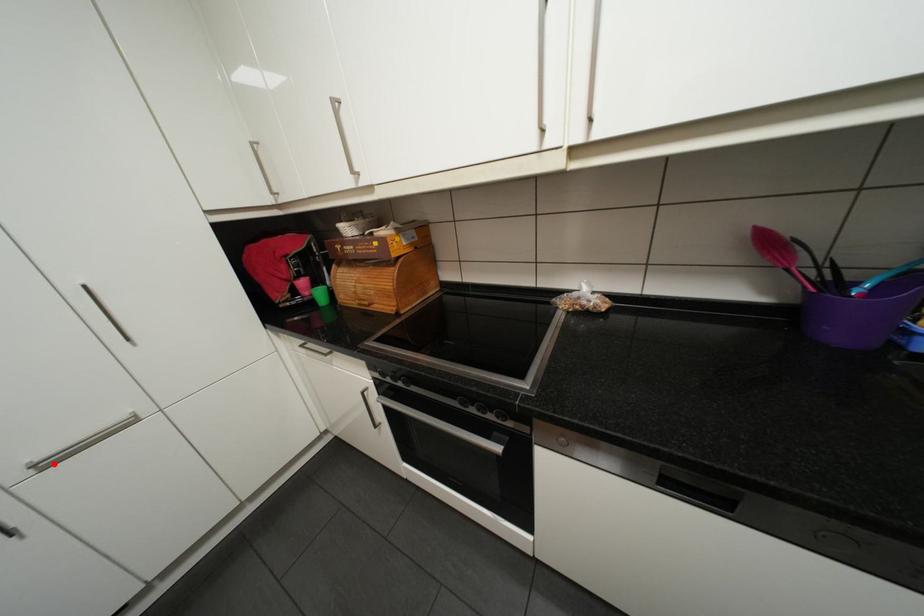
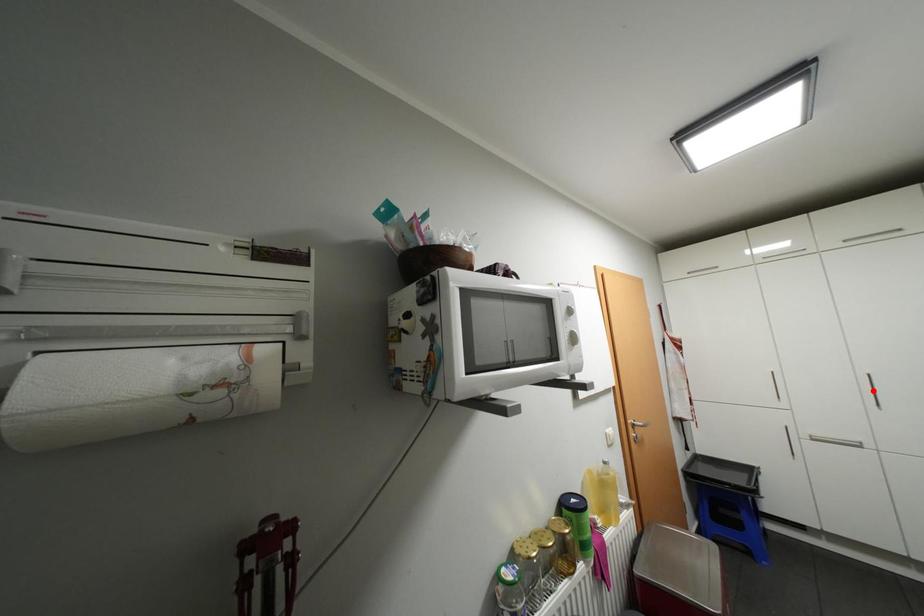
I am providing you with two images of the same scene from different viewpoints. A red point is marked on the first image and another point is marked on the second image. Is the red point in image1 aligned with the point shown in image2?

No